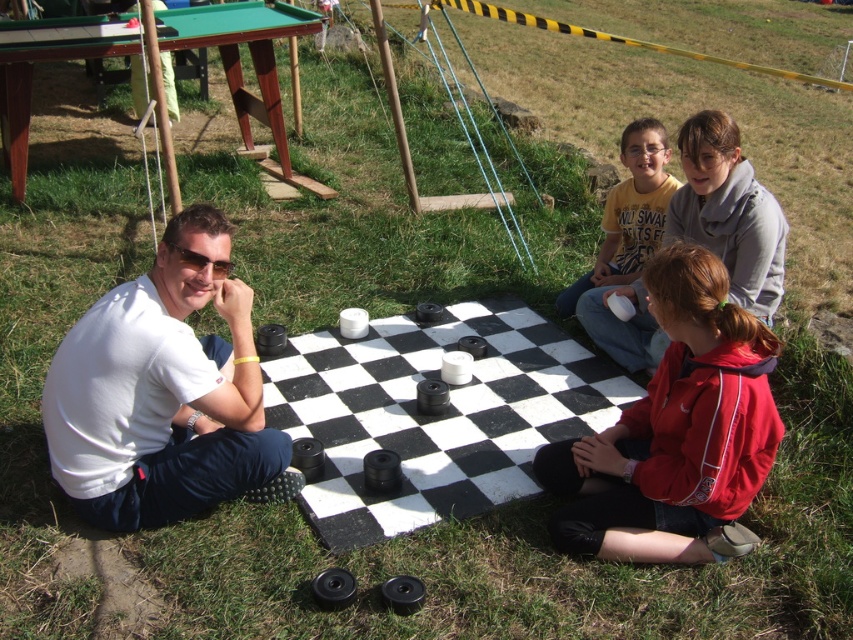
Question: Estimate the real-world distances between objects in this image. Which object is closer to the red fleece jacket at lower right?

Choices:
 (A) yellow cotton shirt at center
 (B) black rubber checkerboard at center
 (C) white matte shirt at left

Answer: (B)

Question: Is black rubber checkerboard at center bigger than red fleece jacket at lower right?

Choices:
 (A) no
 (B) yes

Answer: (B)

Question: Can you confirm if white matte shirt at left is positioned to the left of red fleece jacket at lower right?

Choices:
 (A) yes
 (B) no

Answer: (A)

Question: Based on their relative distances, which object is farther from the red fleece jacket at lower right?

Choices:
 (A) white matte shirt at left
 (B) yellow cotton shirt at center

Answer: (B)

Question: Which point is closer to the camera?

Choices:
 (A) white matte shirt at left
 (B) yellow cotton shirt at center

Answer: (A)

Question: Where is black rubber checkerboard at center located in relation to yellow cotton shirt at center in the image?

Choices:
 (A) below
 (B) above

Answer: (A)